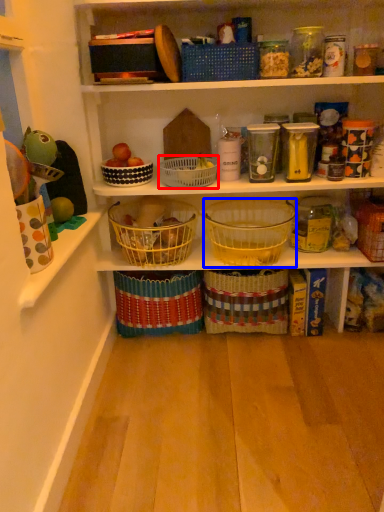
Question: Among these objects, which one is nearest to the camera, basket (highlighted by a red box) or basket (highlighted by a blue box)?

Choices:
 (A) basket
 (B) basket

Answer: (B)